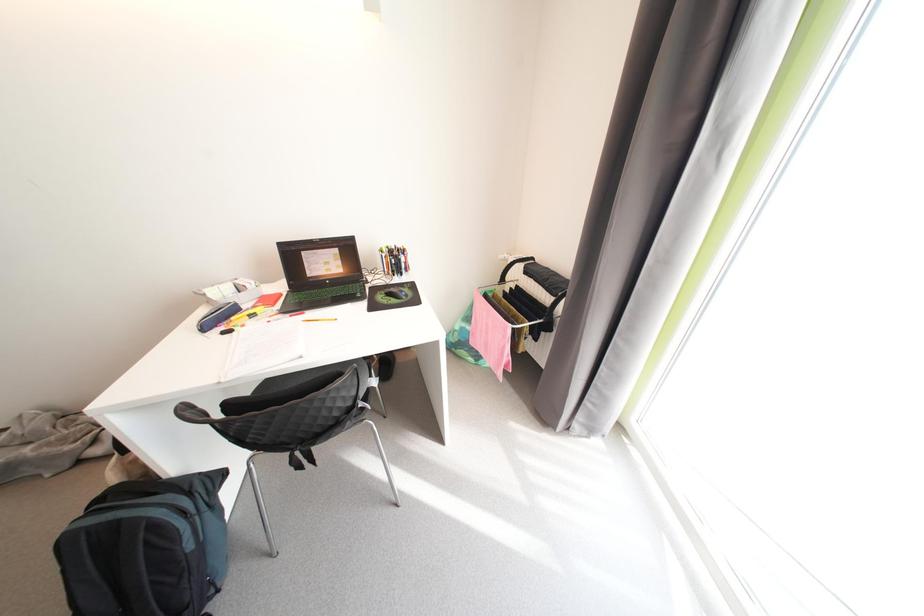
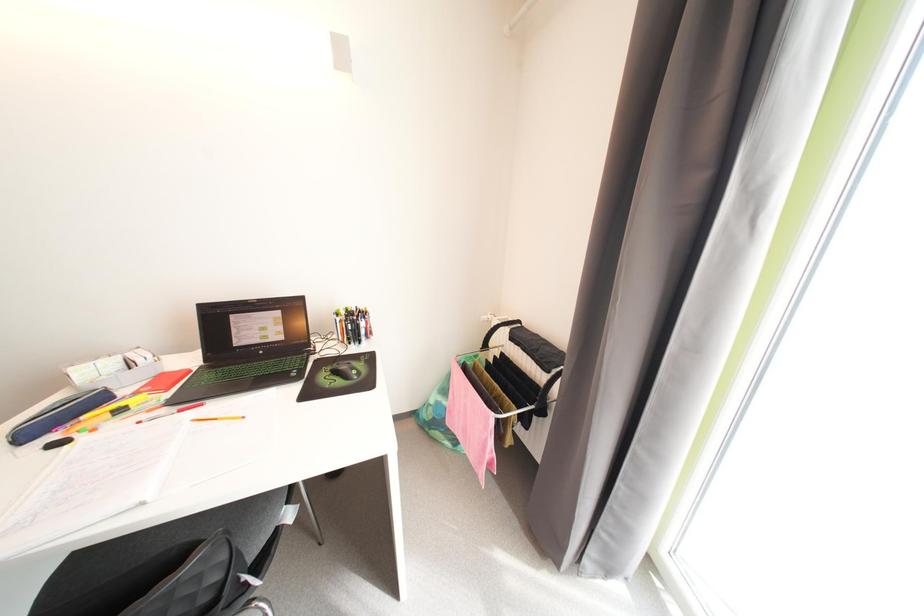
Question: How did the camera likely rotate?

Choices:
 (A) Left
 (B) Right
 (C) Up
 (D) Down

Answer: (C)